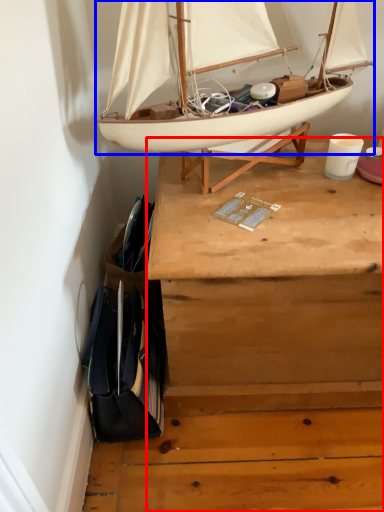
Question: Which of the following is the closest to the observer, desk (highlighted by a red box) or boat (highlighted by a blue box)?

Choices:
 (A) desk
 (B) boat

Answer: (B)